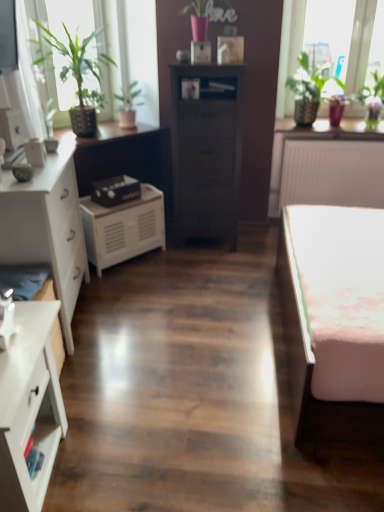
The width and height of the screenshot is (384, 512). I want to click on vacant area located to the right-hand side of dark wood cabinet at center, the 1th chest of drawers positioned from the back, so click(x=258, y=234).